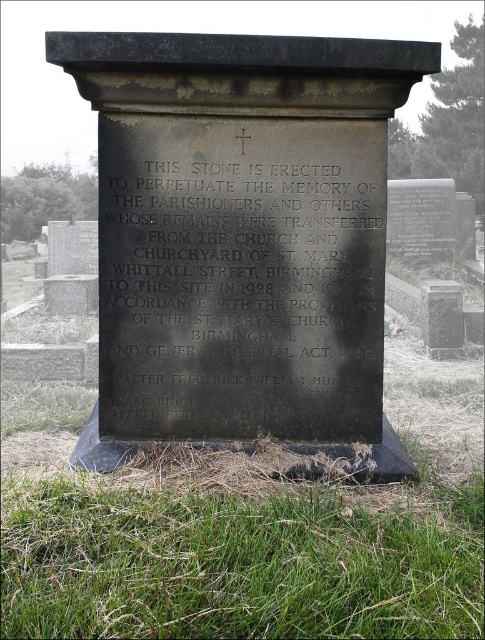
Does black stone monument at center lie in front of black polished stone plaque at center?

Yes, it is in front of black polished stone plaque at center.

Who is shorter, black stone monument at center or black polished stone plaque at center?

black polished stone plaque at center

Between point (371, 195) and point (275, 358), which one is positioned behind?

The point (275, 358) is more distant.

The height and width of the screenshot is (640, 485). Identify the location of black stone monument at center. (242, 237).

Between black polished stone plaque at center and smooth gray stone at center, which one appears on the left side from the viewer's perspective?

From the viewer's perspective, black polished stone plaque at center appears more on the left side.

Does black polished stone plaque at center have a greater height compared to smooth gray stone at center?

Yes, black polished stone plaque at center is taller than smooth gray stone at center.

Which is in front, point (348, 404) or point (448, 296)?

Point (348, 404) is in front.

This screenshot has height=640, width=485. I want to click on black polished stone plaque at center, so click(241, 278).

Does black stone monument at center appear on the left side of smooth gray stone at center?

Correct, you'll find black stone monument at center to the left of smooth gray stone at center.

Between point (304, 138) and point (445, 291), which one is positioned behind?

The point (445, 291) is behind.

What are the coordinates of `black stone monument at center` in the screenshot? It's located at (242, 237).